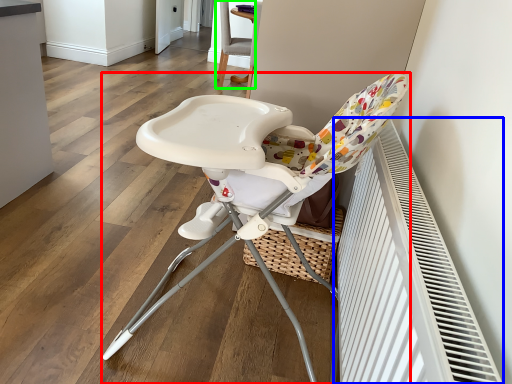
Question: Which object is positioned closest to chair (highlighted by a red box)? Select from air conditioning (highlighted by a blue box) and chair (highlighted by a green box).

Choices:
 (A) air conditioning
 (B) chair

Answer: (A)